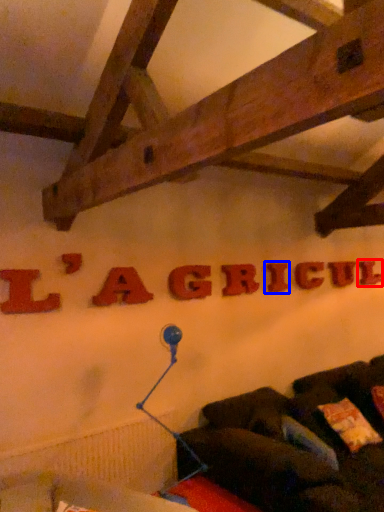
Question: Which of the following is the farthest to the observer, letter (highlighted by a red box) or letter (highlighted by a blue box)?

Choices:
 (A) letter
 (B) letter

Answer: (A)